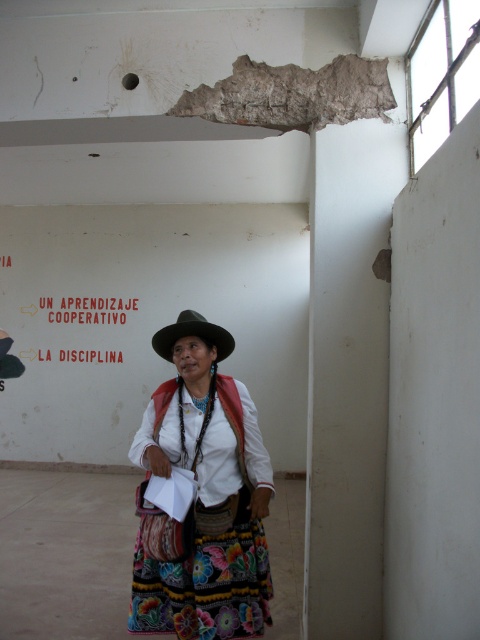
Question: Which object is the farthest from the green felt cowboy hat at center?

Choices:
 (A) embroidered fabric skirt at center
 (B) red paper sign at upper center

Answer: (B)

Question: In this image, where is red paper sign at upper center located relative to green felt cowboy hat at center?

Choices:
 (A) below
 (B) above

Answer: (B)

Question: Among these points, which one is farthest from the camera?

Choices:
 (A) (172, 332)
 (B) (168, 413)

Answer: (B)

Question: Does embroidered fabric skirt at center have a larger size compared to red paper sign at upper center?

Choices:
 (A) yes
 (B) no

Answer: (A)

Question: Estimate the real-world distances between objects in this image. Which object is farther from the embroidered fabric skirt at center?

Choices:
 (A) green felt cowboy hat at center
 (B) red paper sign at upper center

Answer: (B)

Question: Is red paper sign at upper center closer to camera compared to green felt cowboy hat at center?

Choices:
 (A) no
 (B) yes

Answer: (A)